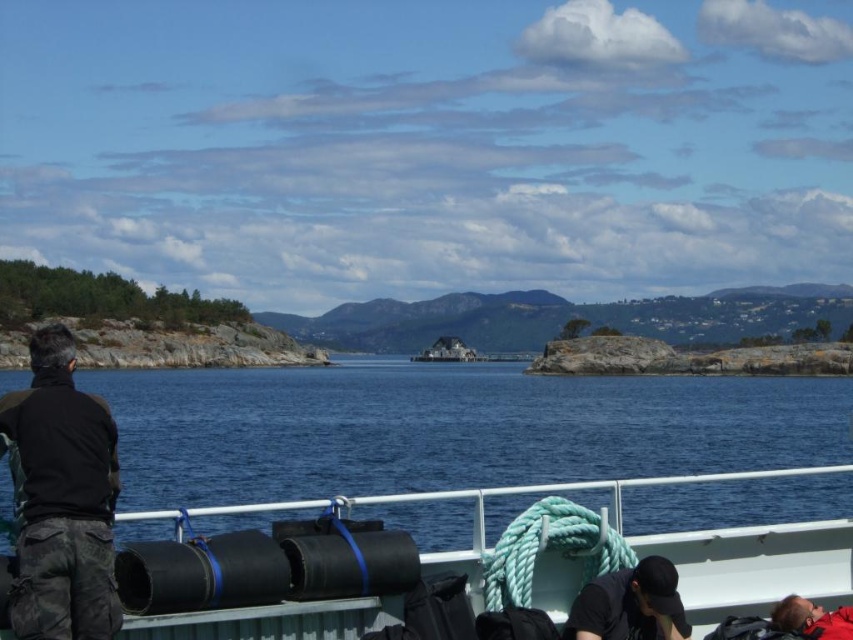
Is rubberized black tubes at center thinner than black matte jacket at left?

Correct, rubberized black tubes at center's width is less than black matte jacket at left's.

Which is in front, point (566, 579) or point (86, 506)?

Point (86, 506) is more forward.

This screenshot has width=853, height=640. I want to click on rubberized black tubes at center, so click(x=756, y=563).

Consider the image. Between blue water at center and rubberized black tubes at center, which one has more height?

blue water at center is taller.

Between blue water at center and rubberized black tubes at center, which one appears on the left side from the viewer's perspective?

Positioned to the left is rubberized black tubes at center.

I want to click on blue water at center, so click(x=448, y=428).

Does black matte diver at lower center have a larger size compared to red fabric diver at lower right?

Indeed, black matte diver at lower center has a larger size compared to red fabric diver at lower right.

Is point (631, 598) closer to viewer compared to point (805, 605)?

Yes.

This screenshot has height=640, width=853. In order to click on black matte diver at lower center in this screenshot , I will do `click(630, 604)`.